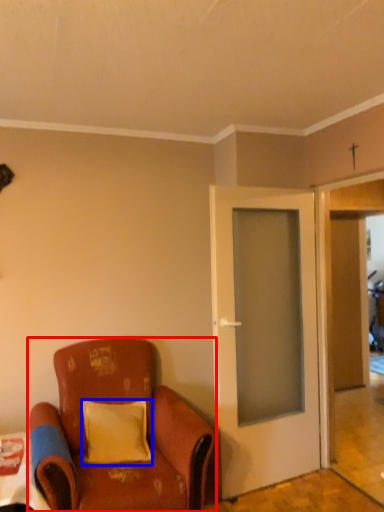
Question: Which object is further to the camera taking this photo, chair (highlighted by a red box) or pillow (highlighted by a blue box)?

Choices:
 (A) chair
 (B) pillow

Answer: (B)